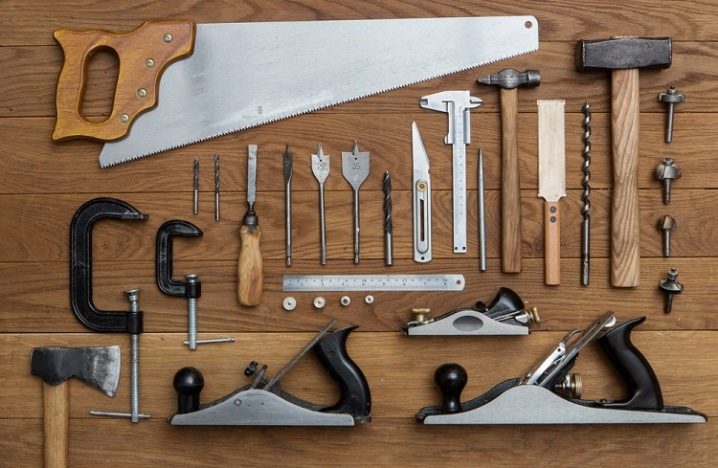
Where is `wood board`? This screenshot has width=718, height=468. wood board is located at coordinates (26, 29), (34, 80), (29, 153), (36, 224), (37, 284), (21, 377), (16, 444).